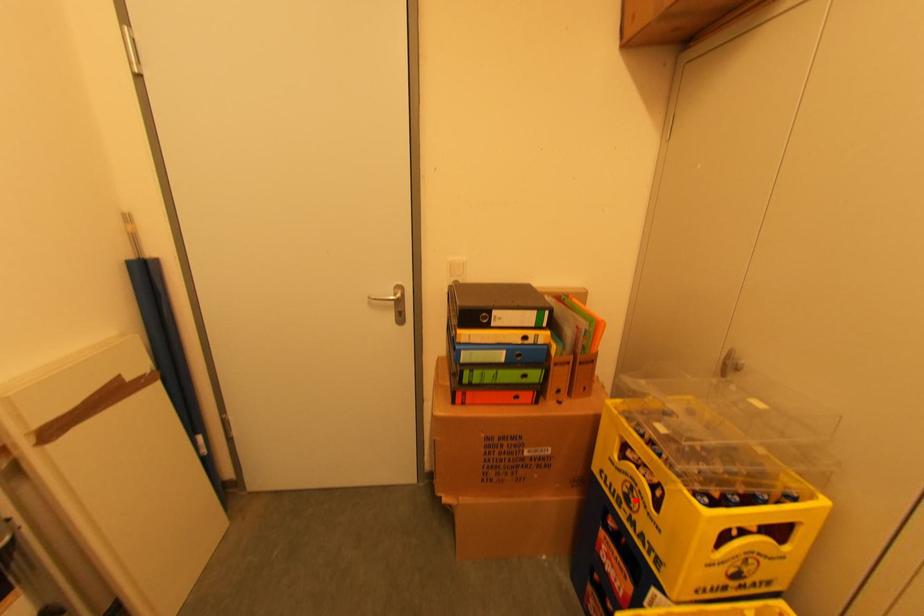
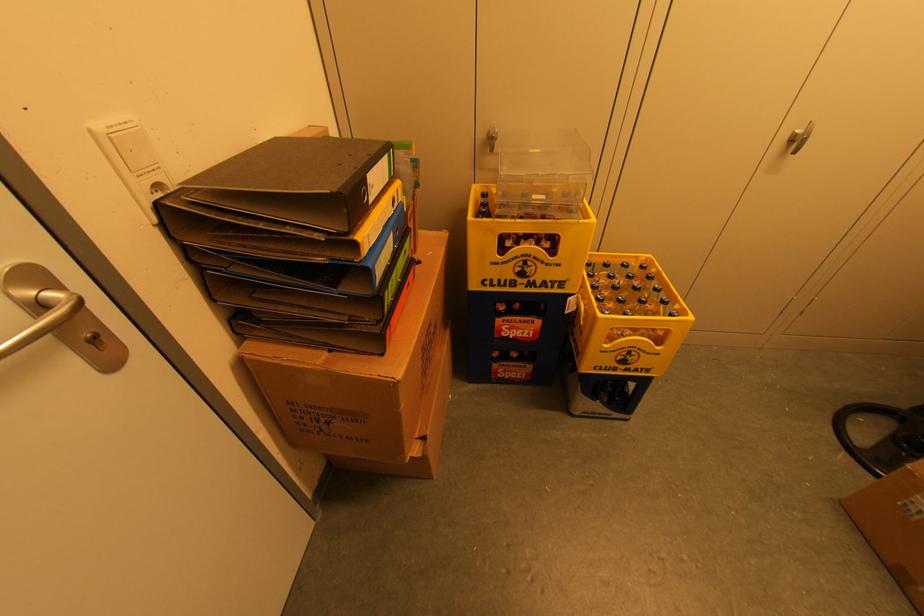
The point at the highlighted location is marked in the first image. Where is the corresponding point in the second image?

(530, 270)